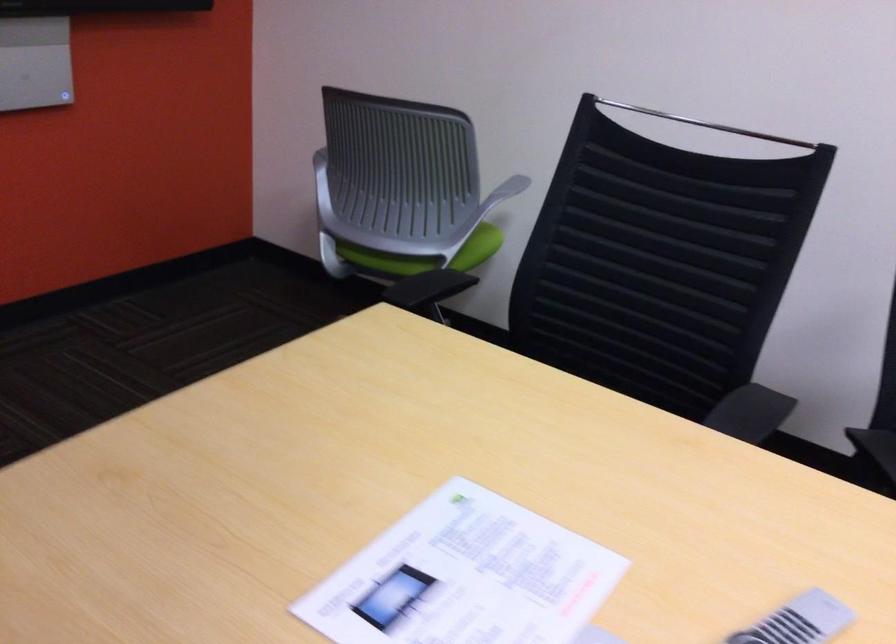
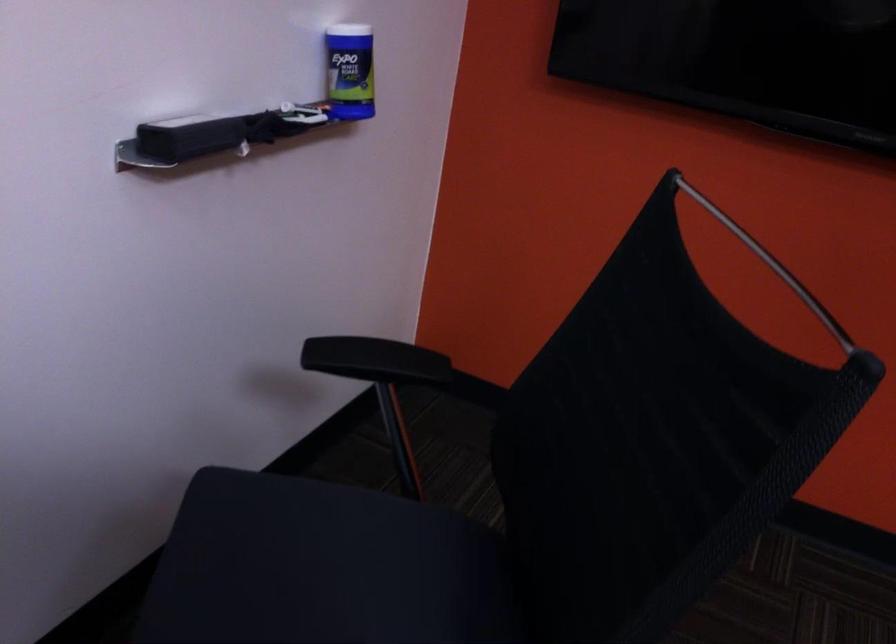
The first image is from the beginning of the video and the second image is from the end. How did the camera likely rotate when shooting the video?

The rotation direction of the camera is left-down.